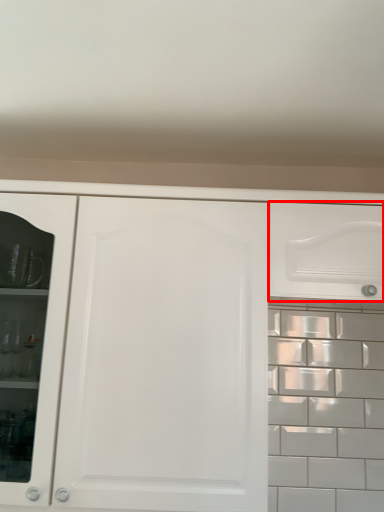
Question: Where is drawer (annotated by the red box) located in relation to cabinetry in the image?

Choices:
 (A) right
 (B) left

Answer: (A)